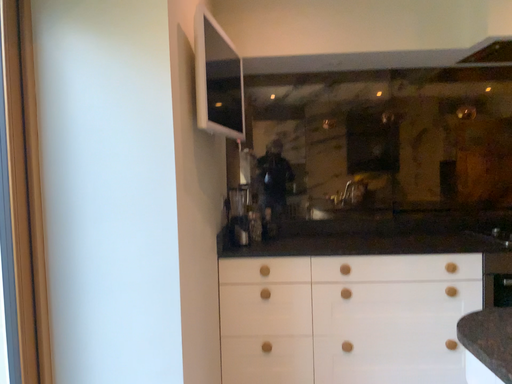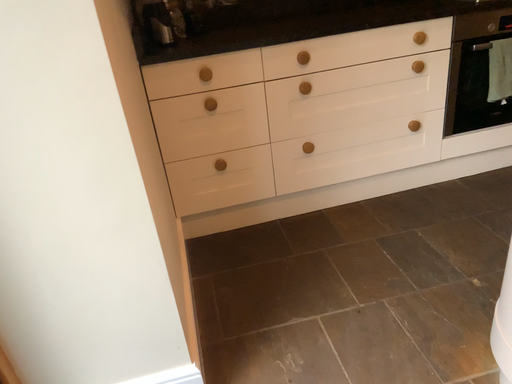
Question: Which way did the camera rotate in the video?

Choices:
 (A) rotated upward
 (B) rotated downward

Answer: (B)